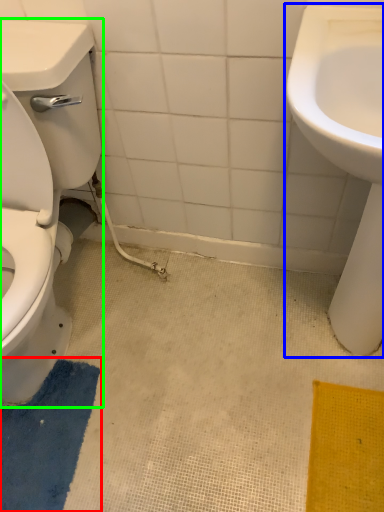
Question: Considering the real-world distances, which object is closest to bath mat (highlighted by a red box)? sink (highlighted by a blue box) or porcelain (highlighted by a green box).

Choices:
 (A) sink
 (B) porcelain

Answer: (B)